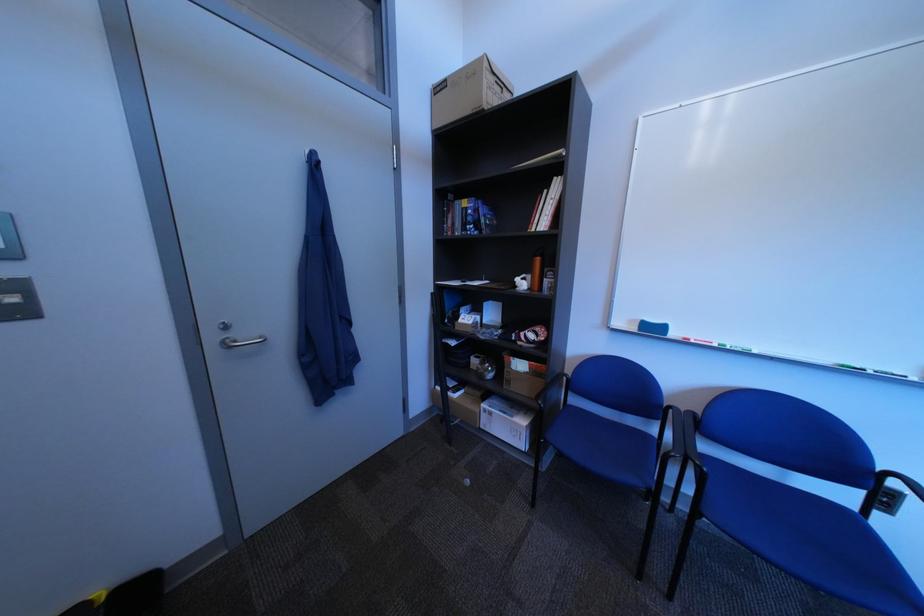
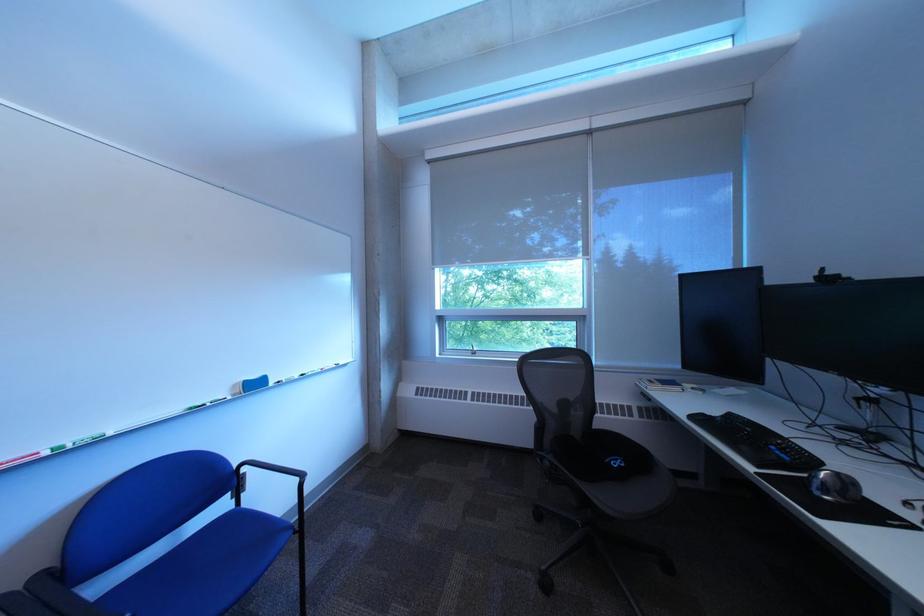
Question: The camera is either moving clockwise (left) or counter-clockwise (right) around the object. The first image is from the beginning of the video and the second image is from the end. Is the camera moving left or right when shooting the video?

Choices:
 (A) Left
 (B) Right

Answer: (A)